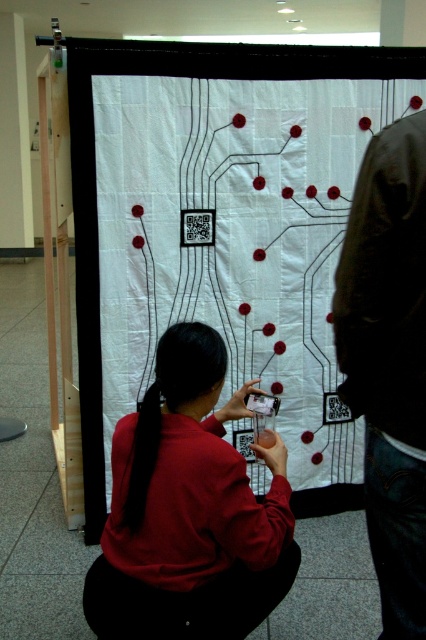
In the scene shown: Can you confirm if white fabric circuit board at center is positioned above matte red shirt at center?

Yes, white fabric circuit board at center is above matte red shirt at center.

Which is in front, point (141, 168) or point (290, 524)?

Point (290, 524) is in front.

The width and height of the screenshot is (426, 640). What are the coordinates of `white fabric circuit board at center` in the screenshot? It's located at (235, 240).

In the scene shown: Is matte red shirt at center closer to the viewer compared to dark brown leather jacket at right?

No, it is behind dark brown leather jacket at right.

Between point (192, 474) and point (416, 145), which one is positioned in front?

Point (416, 145) is in front.

The image size is (426, 640). Find the location of `matte red shirt at center`. matte red shirt at center is located at coordinates (189, 509).

Is white fabric circuit board at center taller than dark brown leather jacket at right?

Correct, white fabric circuit board at center is much taller as dark brown leather jacket at right.

Which is behind, point (101, 115) or point (374, 403)?

Positioned behind is point (101, 115).

Is point (249, 93) positioned behind point (370, 339)?

Yes.

Locate an element on the screen. white fabric circuit board at center is located at coordinates (235, 240).